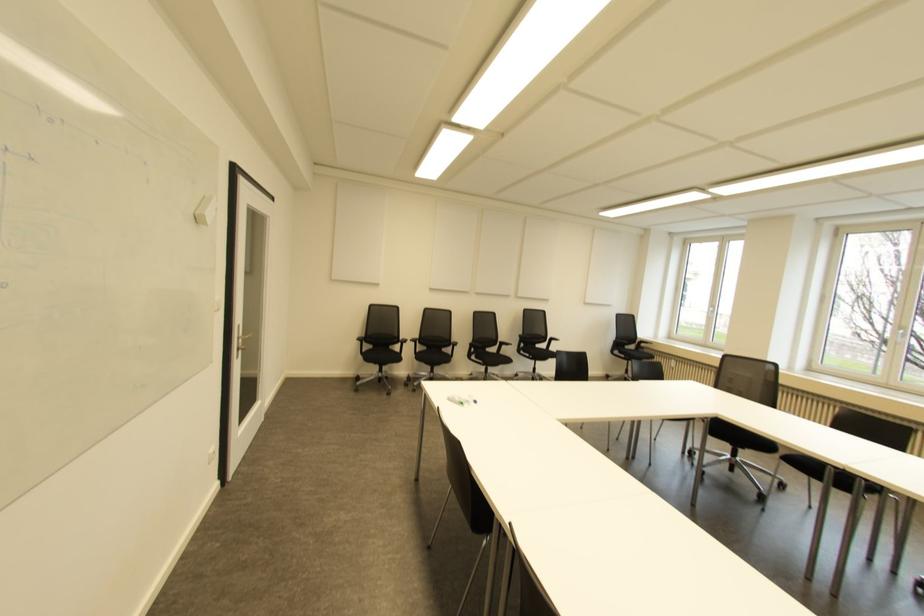
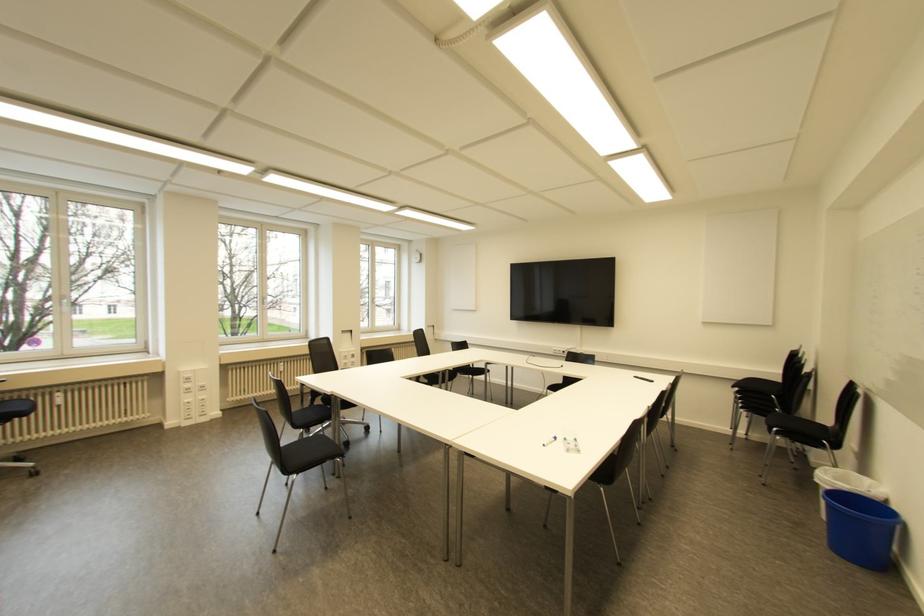
Find the pixel in the second image that matches (475,400) in the first image.

(554, 438)